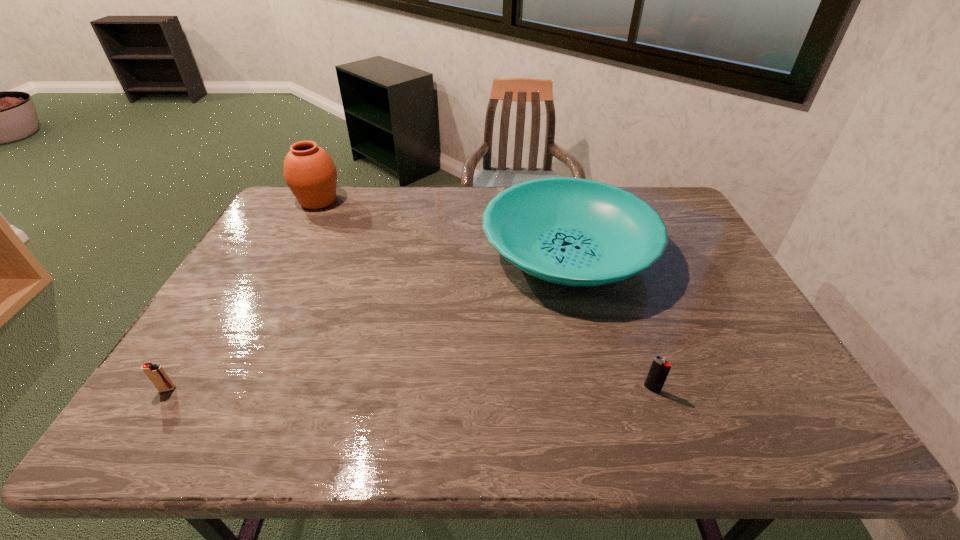
This screenshot has width=960, height=540. I want to click on vacant area at the far right corner of the desktop, so click(659, 207).

Where is `vacant space that is in between the left igniter and the third object from right to left`? vacant space that is in between the left igniter and the third object from right to left is located at coordinates (243, 295).

This screenshot has height=540, width=960. I want to click on vacant area between the dish and the leftmost object, so click(x=368, y=321).

Identify the location of blank region between the second object from left to right and the dish. (444, 227).

Identify the location of free space between the urn and the shorter igniter. (243, 295).

Where is `empty space that is in between the taller igniter and the third object from right to left`? empty space that is in between the taller igniter and the third object from right to left is located at coordinates (485, 295).

Find the location of a particular element. The height and width of the screenshot is (540, 960). vacant area that lies between the shortest object and the dish is located at coordinates (368, 321).

Where is `free spot between the taller igniter and the tallest object`? The width and height of the screenshot is (960, 540). free spot between the taller igniter and the tallest object is located at coordinates (485, 295).

Where is `free spot between the taller igniter and the shortest object`? free spot between the taller igniter and the shortest object is located at coordinates (410, 389).

Identify the location of empty space between the dish and the tallest object. (444, 227).